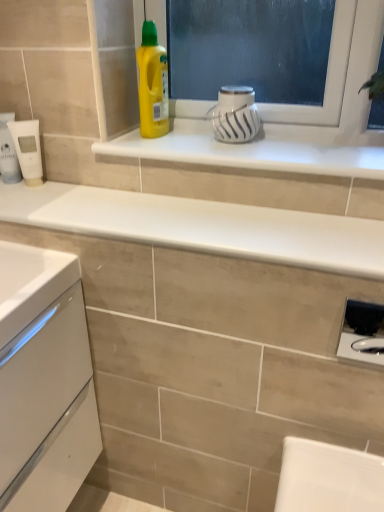
Locate an element on the screen. The image size is (384, 512). vacant region to the right of white matte tube at left, placed as the first appliance when sorted from left to right is located at coordinates (80, 193).